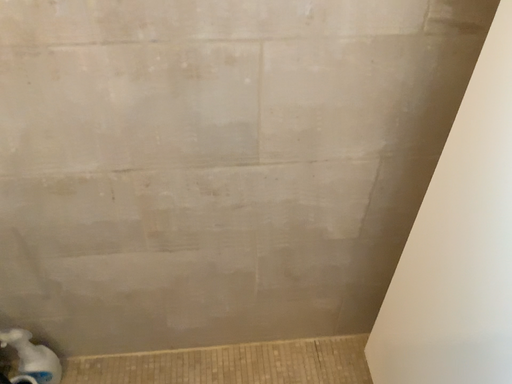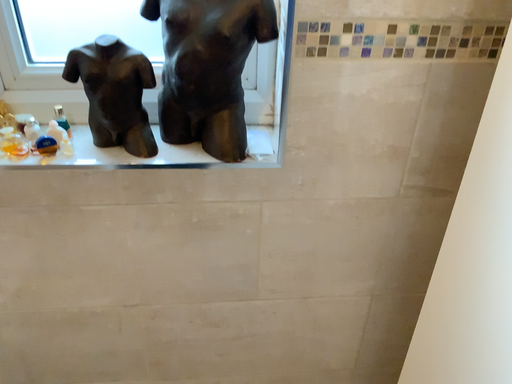
Question: Which way did the camera rotate in the video?

Choices:
 (A) rotated downward
 (B) rotated upward

Answer: (B)